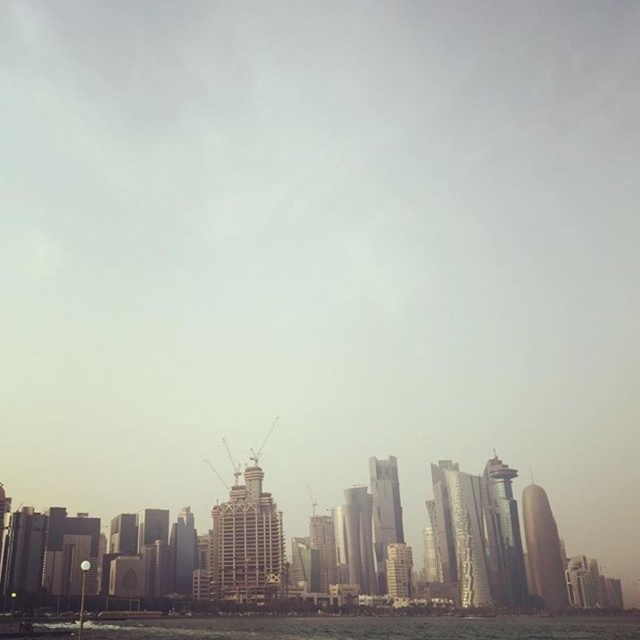
Question: Which of these objects is positioned farthest from the gold metallic tower at right?

Choices:
 (A) glassy skyscraper at center
 (B) metallic glass skyscraper at center
 (C) shiny metallic skyscraper at center
 (D) green water at lower center

Answer: (B)

Question: Does green water at lower center have a smaller size compared to glassy skyscraper at center?

Choices:
 (A) yes
 (B) no

Answer: (B)

Question: Observing the image, what is the correct spatial positioning of glassy skyscraper at center in reference to shiny metallic skyscraper at center?

Choices:
 (A) above
 (B) below

Answer: (B)

Question: Is glassy skyscraper at center wider than gold metallic tower at right?

Choices:
 (A) yes
 (B) no

Answer: (B)

Question: Considering the real-world distances, which object is farthest from the gold metallic tower at right?

Choices:
 (A) metallic glass skyscraper at center
 (B) shiny metallic skyscraper at center

Answer: (A)

Question: Which of these objects is positioned farthest from the metallic glass skyscraper at center?

Choices:
 (A) glassy skyscraper at center
 (B) gold metallic tower at right
 (C) green water at lower center

Answer: (B)